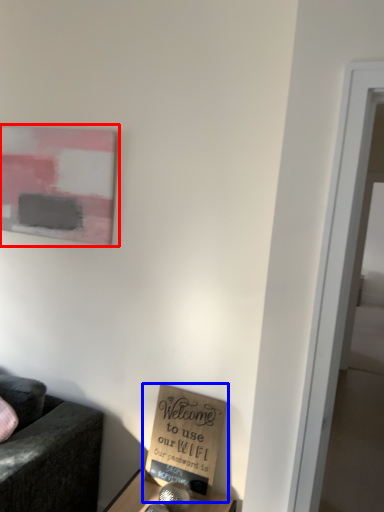
Question: Which of the following is the closest to the observer, picture frame (highlighted by a red box) or cardboard box (highlighted by a blue box)?

Choices:
 (A) picture frame
 (B) cardboard box

Answer: (B)